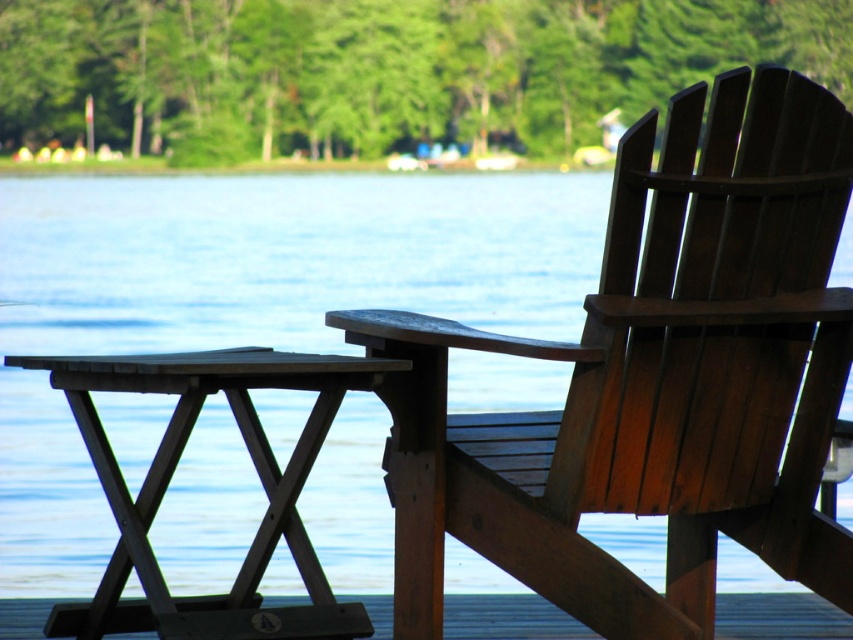
You are planning to set up a small garden between the wooden picnic table at lower left and the wooden deck at lower center. Considering their widths, which object should you place closer to the edge of the dock to ensure there is enough space for the garden?

The wooden picnic table at lower left has a larger width than the wooden deck at lower center. To ensure enough space for the garden, you should place the wooden picnic table at lower left closer to the edge of the dock so the narrower wooden deck at lower center allows more space in the middle for the garden.

You are planning to place a new bench next to the wooden chair at right and the wooden deck at lower center. Considering their widths, which object should the bench be placed closer to to ensure it doesn

The wooden chair at right is wider than the wooden deck at lower center. Therefore, the bench should be placed closer to the wooden deck at lower center to ensure it fits properly.

You are standing on the dock and want to place a large fishbowl on the surface nearest to you. Which object, the wooden chair at right or the wooden picnic table at lower left, should you choose?

The wooden picnic table at lower left is the nearest to you since it is positioned lower than the wooden chair at right, which is above it.